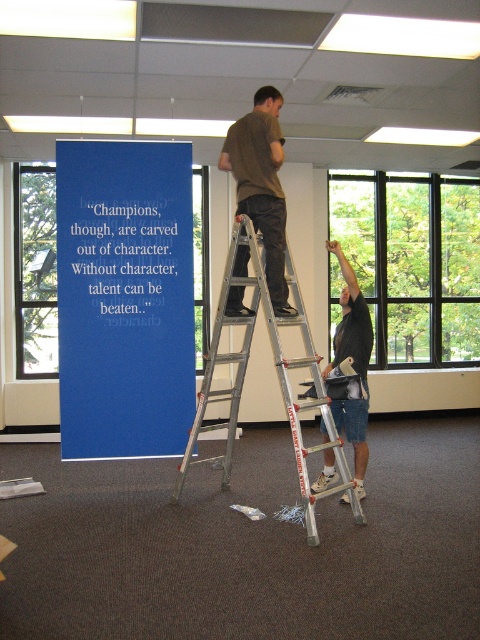
Question: Does blue matte sign at center have a larger size compared to brown cotton shirt at upper center?

Choices:
 (A) no
 (B) yes

Answer: (B)

Question: Where is silver metallic ladder at center located in relation to brown cotton shirt at upper center in the image?

Choices:
 (A) left
 (B) right

Answer: (A)

Question: In this image, where is silver metallic ladder at center located relative to dark blue jeans at center?

Choices:
 (A) right
 (B) left

Answer: (B)

Question: Which of the following is the farthest from the observer?

Choices:
 (A) (189, 445)
 (B) (167, 262)
 (C) (242, 209)
 (D) (73, 230)

Answer: (B)

Question: Which point is closer to the camera?

Choices:
 (A) blue matte sign at center
 (B) brown cotton shirt at upper center
 (C) dark blue jeans at center
 (D) blue paper at center

Answer: (B)

Question: Which point appears closest to the camera in this image?

Choices:
 (A) (262, 250)
 (B) (136, 440)
 (C) (342, 292)
 (D) (219, 168)

Answer: (A)